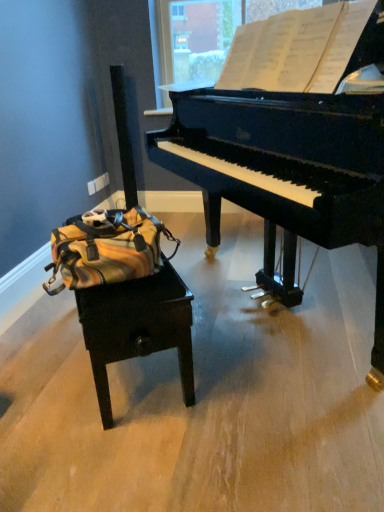
In order to click on yellow striped fabric messenger bag at left in this screenshot , I will do `click(106, 248)`.

What do you see at coordinates (291, 144) in the screenshot? I see `black polished piano at upper right` at bounding box center [291, 144].

Identify the location of white paper at upper center. pyautogui.click(x=296, y=49).

From the picture: Measure the distance from white paper at upper center to wooden table at lower left.

white paper at upper center is 38.61 inches away from wooden table at lower left.

Which is more to the left, white paper at upper center or wooden table at lower left?

From the viewer's perspective, wooden table at lower left appears more on the left side.

From the image's perspective, is white paper at upper center positioned above or below wooden table at lower left?

white paper at upper center is situated higher than wooden table at lower left in the image.

From a real-world perspective, relative to wooden table at lower left, is white paper at upper center vertically above or below?

In terms of real-world spatial position, white paper at upper center is above wooden table at lower left.

From the image's perspective, which object appears higher, yellow striped fabric messenger bag at left or black polished piano at upper right?

black polished piano at upper right is shown above in the image.

Considering the relative sizes of yellow striped fabric messenger bag at left and black polished piano at upper right in the image provided, is yellow striped fabric messenger bag at left shorter than black polished piano at upper right?

Yes.

Which is more to the right, yellow striped fabric messenger bag at left or black polished piano at upper right?

black polished piano at upper right is more to the right.

Could you tell me if yellow striped fabric messenger bag at left is turned towards black polished piano at upper right?

Yes.

Is white paper at upper center taller than yellow striped fabric messenger bag at left?

Yes, white paper at upper center is taller than yellow striped fabric messenger bag at left.

Is white paper at upper center situated inside yellow striped fabric messenger bag at left or outside?

white paper at upper center is not inside yellow striped fabric messenger bag at left, it's outside.

The width and height of the screenshot is (384, 512). Find the location of `window screen behind the yellow striped fabric messenger bag at left`. window screen behind the yellow striped fabric messenger bag at left is located at coordinates (296, 49).

Considering the sizes of objects white paper at upper center and yellow striped fabric messenger bag at left in the image provided, who is thinner, white paper at upper center or yellow striped fabric messenger bag at left?

white paper at upper center is thinner.

Which is behind, point (186, 391) or point (303, 190)?

The point (186, 391) is farther.

Considering the sizes of objects wooden table at lower left and black polished piano at upper right in the image provided, who is smaller, wooden table at lower left or black polished piano at upper right?

Smaller between the two is wooden table at lower left.

From the image's perspective, which one is positioned lower, wooden table at lower left or black polished piano at upper right?

wooden table at lower left appears lower in the image.

Is wooden table at lower left looking in the opposite direction of black polished piano at upper right?

wooden table at lower left does not have its back to black polished piano at upper right.

From a real-world perspective, who is located higher, yellow striped fabric messenger bag at left or wooden table at lower left?

In real-world perspective, yellow striped fabric messenger bag at left is above.

Considering the sizes of objects yellow striped fabric messenger bag at left and wooden table at lower left in the image provided, who is wider, yellow striped fabric messenger bag at left or wooden table at lower left?

With larger width is yellow striped fabric messenger bag at left.

Which object is positioned more to the right, yellow striped fabric messenger bag at left or wooden table at lower left?

Positioned to the right is yellow striped fabric messenger bag at left.

Is yellow striped fabric messenger bag at left not near wooden table at lower left?

No, there isn't a large distance between yellow striped fabric messenger bag at left and wooden table at lower left.

This screenshot has width=384, height=512. Identify the location of table behind the black polished piano at upper right. (137, 327).

Looking at their sizes, would you say black polished piano at upper right is wider or thinner than wooden table at lower left?

Clearly, black polished piano at upper right has more width compared to wooden table at lower left.

From a real-world perspective, is black polished piano at upper right positioned over wooden table at lower left based on gravity?

Yes, from a real-world perspective, black polished piano at upper right is over wooden table at lower left

Would you say black polished piano at upper right is a long distance from wooden table at lower left?

No.

How far apart are black polished piano at upper right and white paper at upper center?

black polished piano at upper right and white paper at upper center are 12.23 inches apart from each other.

From a real-world perspective, which object stands above the other?

white paper at upper center is physically above.

Is black polished piano at upper right completely or partially outside of white paper at upper center?

Yes, black polished piano at upper right is not within white paper at upper center.

Which object is more forward, black polished piano at upper right or white paper at upper center?

black polished piano at upper right is more forward.

The width and height of the screenshot is (384, 512). Find the location of `window screen in front of the wooden table at lower left`. window screen in front of the wooden table at lower left is located at coordinates (296, 49).

Where is `piano on the right side of yellow striped fabric messenger bag at left`? The image size is (384, 512). piano on the right side of yellow striped fabric messenger bag at left is located at coordinates (291, 144).

Based on their spatial positions, is wooden table at lower left or black polished piano at upper right closer to yellow striped fabric messenger bag at left?

wooden table at lower left.

Looking at the image, which one is located closer to white paper at upper center, wooden table at lower left or black polished piano at upper right?

black polished piano at upper right lies closer to white paper at upper center than the other object.

Estimate the real-world distances between objects in this image. Which object is closer to yellow striped fabric messenger bag at left, white paper at upper center or black polished piano at upper right?

black polished piano at upper right is positioned closer to the anchor yellow striped fabric messenger bag at left.

Looking at the image, which one is located further to white paper at upper center, black polished piano at upper right or wooden table at lower left?

wooden table at lower left is positioned further to the anchor white paper at upper center.

When comparing their distances from wooden table at lower left, does yellow striped fabric messenger bag at left or black polished piano at upper right seem further?

The object further to wooden table at lower left is black polished piano at upper right.

From the picture: From the image, which object appears to be farther from wooden table at lower left, white paper at upper center or black polished piano at upper right?

white paper at upper center.

Estimate the real-world distances between objects in this image. Which object is closer to yellow striped fabric messenger bag at left, wooden table at lower left or white paper at upper center?

wooden table at lower left lies closer to yellow striped fabric messenger bag at left than the other object.

Based on their spatial positions, is yellow striped fabric messenger bag at left or wooden table at lower left closer to white paper at upper center?

Among the two, yellow striped fabric messenger bag at left is located nearer to white paper at upper center.

The image size is (384, 512). Find the location of `messenger bag between wooden table at lower left and black polished piano at upper right`. messenger bag between wooden table at lower left and black polished piano at upper right is located at coordinates (106, 248).

Identify the location of window screen between yellow striped fabric messenger bag at left and black polished piano at upper right in the horizontal direction. (296, 49).

You are a GUI agent. You are given a task and a screenshot of the screen. Output one action in this format:
    pyautogui.click(x=<x>, y=<y>)
    Task: Click on the window screen situated between wooden table at lower left and black polished piano at upper right from left to right
    
    Given the screenshot: What is the action you would take?
    pyautogui.click(x=296, y=49)

What are the coordinates of `messenger bag between white paper at upper center and wooden table at lower left in the vertical direction` in the screenshot? It's located at (106, 248).